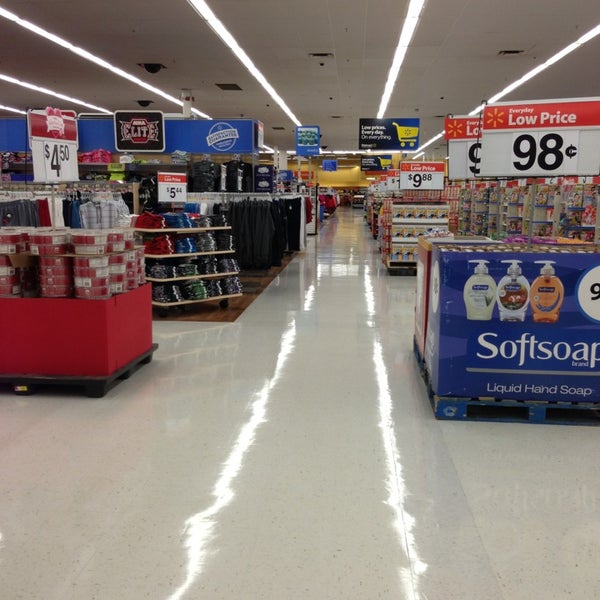
The height and width of the screenshot is (600, 600). I want to click on vents, so click(160, 63).